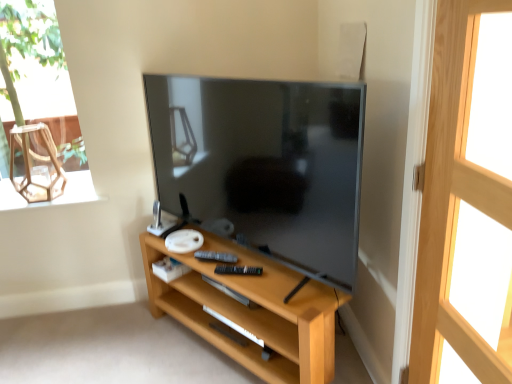
Question: Is light wood shelf at center located outside black plastic remote at center?

Choices:
 (A) yes
 (B) no

Answer: (A)

Question: From the image's perspective, is light wood shelf at center over black plastic remote at center?

Choices:
 (A) yes
 (B) no

Answer: (B)

Question: Can you confirm if light wood shelf at center is wider than black plastic remote at center?

Choices:
 (A) yes
 (B) no

Answer: (A)

Question: Is light wood shelf at center in front of black plastic remote at center?

Choices:
 (A) no
 (B) yes

Answer: (B)

Question: Is light wood shelf at center next to black plastic remote at center?

Choices:
 (A) no
 (B) yes

Answer: (A)

Question: Based on their positions, is matte black tv at center located to the left or right of light wood shelf at center?

Choices:
 (A) left
 (B) right

Answer: (A)

Question: Is matte black tv at center inside the boundaries of light wood shelf at center, or outside?

Choices:
 (A) inside
 (B) outside

Answer: (B)

Question: From their relative heights in the image, would you say matte black tv at center is taller or shorter than light wood shelf at center?

Choices:
 (A) short
 (B) tall

Answer: (B)

Question: Is point (290, 114) positioned closer to the camera than point (308, 288)?

Choices:
 (A) farther
 (B) closer

Answer: (B)

Question: Is clear glass window at upper left inside the boundaries of transparent glass armchair at upper left, or outside?

Choices:
 (A) outside
 (B) inside

Answer: (A)

Question: From a real-world perspective, is clear glass window at upper left positioned above or below transparent glass armchair at upper left?

Choices:
 (A) above
 (B) below

Answer: (A)

Question: Is point (20, 44) positioned closer to the camera than point (10, 134)?

Choices:
 (A) closer
 (B) farther

Answer: (B)

Question: In terms of height, does clear glass window at upper left look taller or shorter compared to transparent glass armchair at upper left?

Choices:
 (A) short
 (B) tall

Answer: (B)

Question: Would you say clear glass window sill at left is inside or outside transparent glass armchair at upper left?

Choices:
 (A) outside
 (B) inside

Answer: (A)

Question: Is point (83, 175) positioned closer to the camera than point (57, 190)?

Choices:
 (A) closer
 (B) farther

Answer: (B)